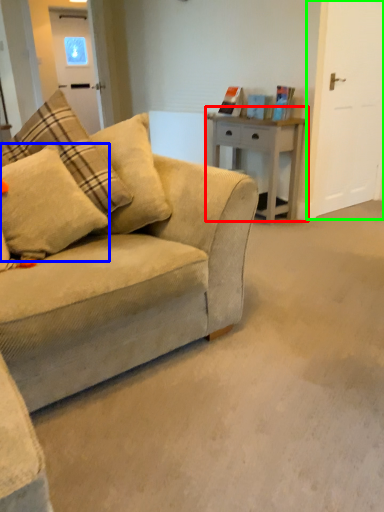
Question: Which is farther away from table (highlighted by a red box)? pillow (highlighted by a blue box) or glass door (highlighted by a green box)?

Choices:
 (A) pillow
 (B) glass door

Answer: (A)